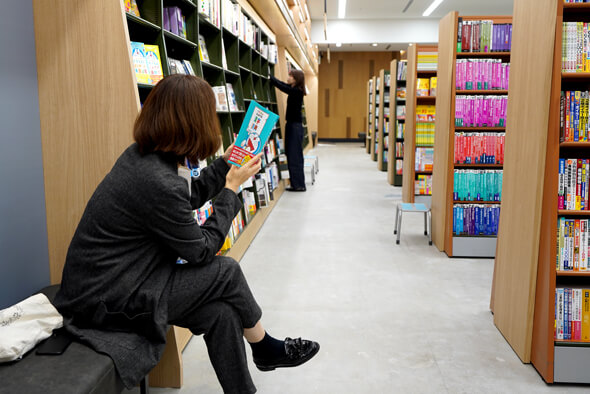
Locate an element on the screen. The image size is (590, 394). light fixtures is located at coordinates (337, 18), (431, 12).